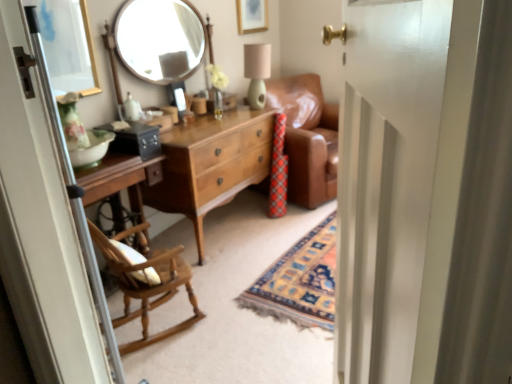
You are a GUI agent. You are given a task and a screenshot of the screen. Output one action in this format:
    pyautogui.click(x=<x>, y=<y>)
    Task: Click on the free space underneath light brown wood dresser at center (from a real-world perspective)
    This screenshot has width=512, height=384.
    Given the screenshot: What is the action you would take?
    pyautogui.click(x=221, y=224)